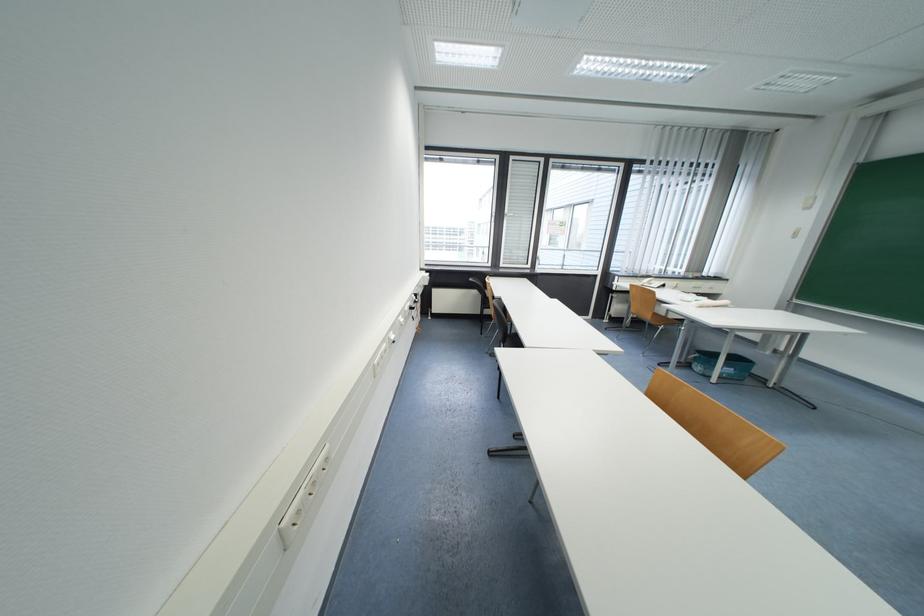
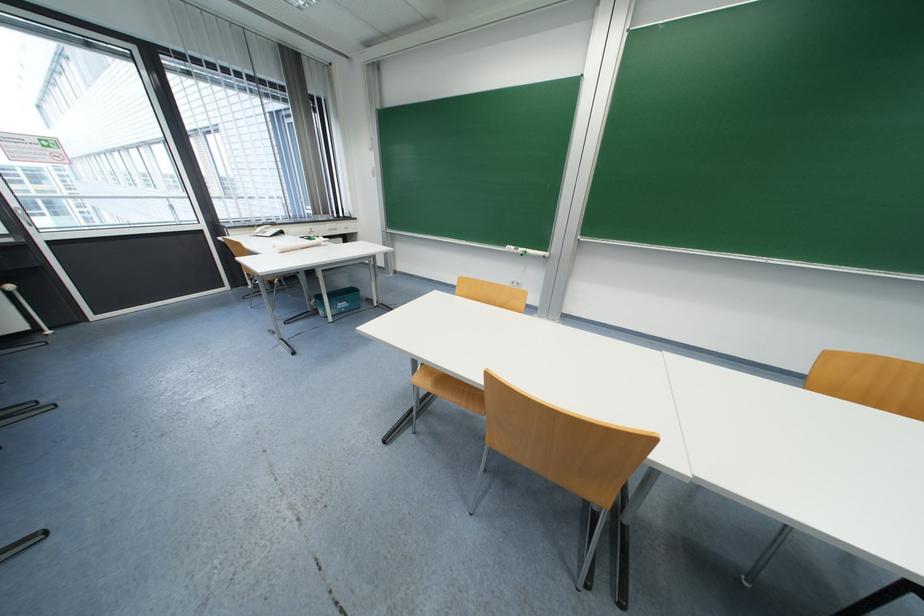
The point at (x=734, y=377) is marked in the first image. Where is the corresponding point in the second image?

(350, 310)